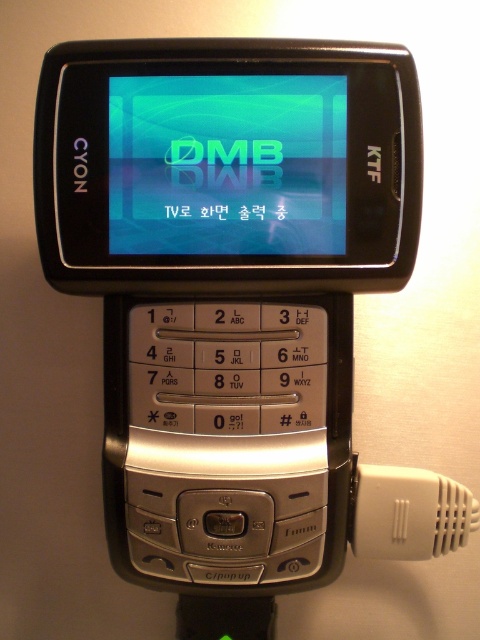
Based on the photo, you are holding a flip phone and want to connect it to a charger. The charger has a white plastic connector at lower right. Where should you place the charger connector relative to the matte blue screen at center?

You should place the charger connector at the lower right to the right of the matte blue screen at center, since the matte blue screen at center is located to the left of the white plastic connector at lower right.

You are designing a protective case for a flip phone. The case must accommodate both the matte blue screen at center and the white plastic connector at lower right. Based on the phone design, which object requires more horizontal space in the case design?

The matte blue screen at center requires more horizontal space in the case design because it is wider than the white plastic connector at lower right.